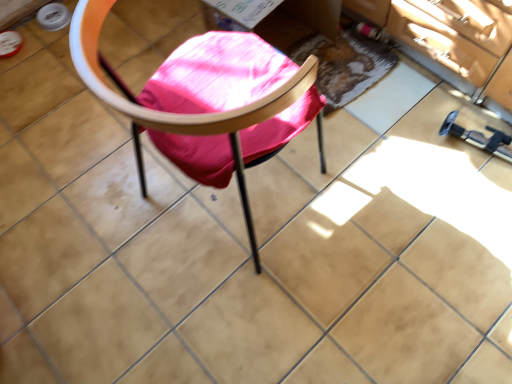
You are a GUI agent. You are given a task and a screenshot of the screen. Output one action in this format:
    pyautogui.click(x=<x>, y=<y>)
    Task: Click on the vacant space in textured woolen mat at center (from a real-world perspective)
    The width and height of the screenshot is (512, 384).
    Given the screenshot: What is the action you would take?
    357,64